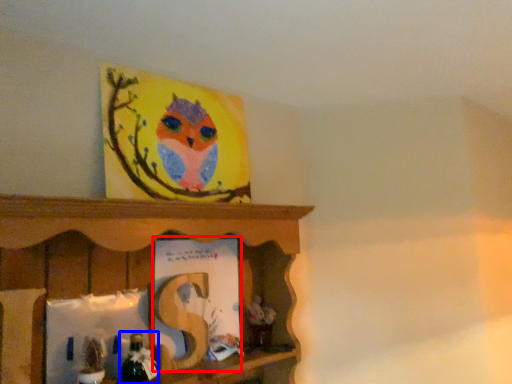
Question: Which of the following is the farthest to the observer, book (highlighted by a red box) or toy (highlighted by a blue box)?

Choices:
 (A) book
 (B) toy

Answer: (A)